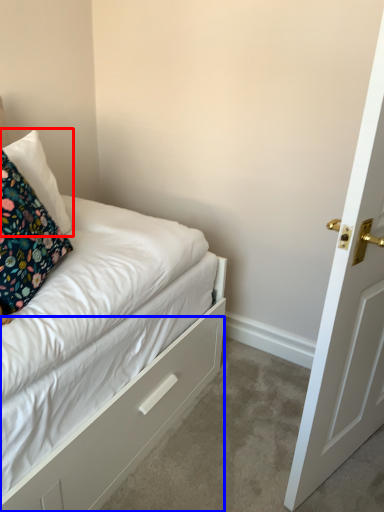
Question: Which point is closer to the camera, pillow (highlighted by a red box) or drawer (highlighted by a blue box)?

Choices:
 (A) pillow
 (B) drawer

Answer: (B)